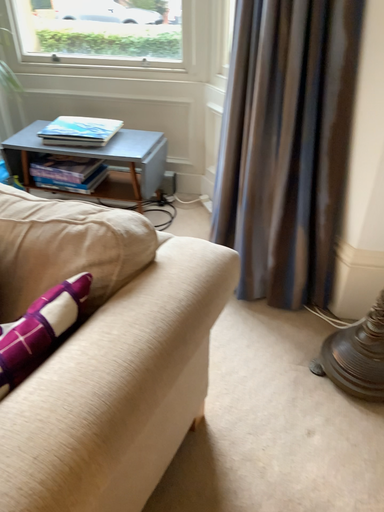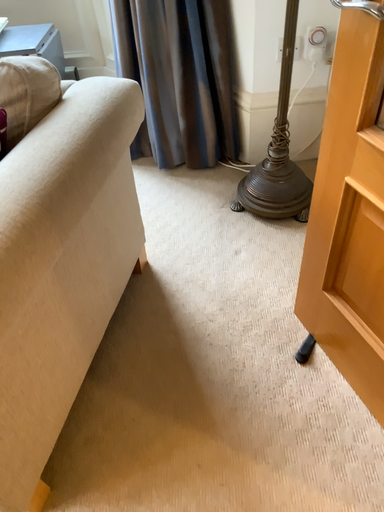
Question: Which way did the camera rotate in the video?

Choices:
 (A) rotated left
 (B) rotated right

Answer: (B)